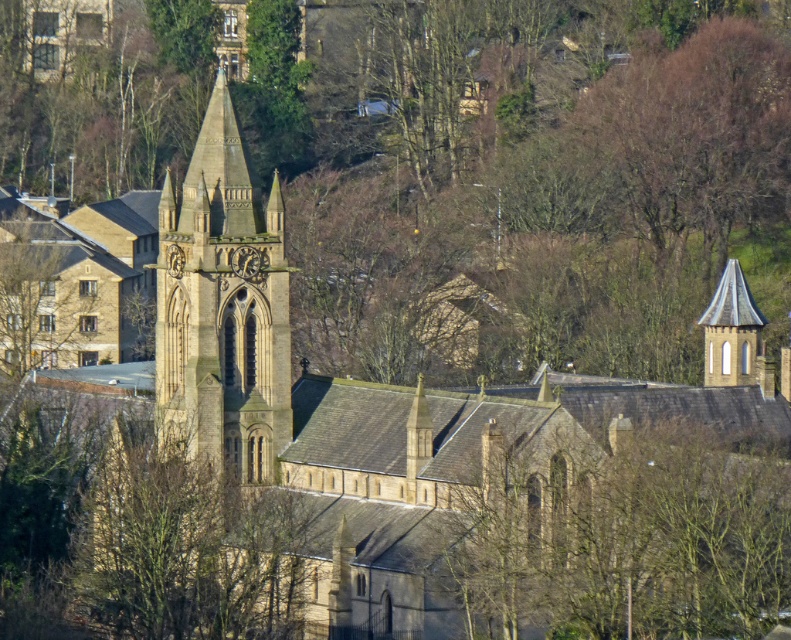
Is point (256, 291) in front of point (729, 268)?

Yes, it is in front of point (729, 268).

Locate an element on the screen. This screenshot has width=791, height=640. brown stone tower at center is located at coordinates (222, 308).

Measure the distance between brown stone tower at center and camera.

brown stone tower at center is 469.90 feet away from camera.

This screenshot has height=640, width=791. What are the coordinates of `brown stone tower at center` in the screenshot? It's located at (222, 308).

Is point (771, 512) more distant than point (184, 356)?

That is False.

Which is behind, point (657, 500) or point (199, 340)?

The point (199, 340) is behind.

What are the coordinates of `green leafy tree at center` in the screenshot? It's located at (631, 545).

Measure the distance between point [689,557] and camera.

Point [689,557] and camera are 398.60 feet apart.

Who is taller, green leafy tree at center or smooth gray stone tower at right?

Standing taller between the two is green leafy tree at center.

Which is behind, point (562, 564) or point (735, 272)?

The point (735, 272) is more distant.

Where is `green leafy tree at center`? The image size is (791, 640). green leafy tree at center is located at coordinates (631, 545).